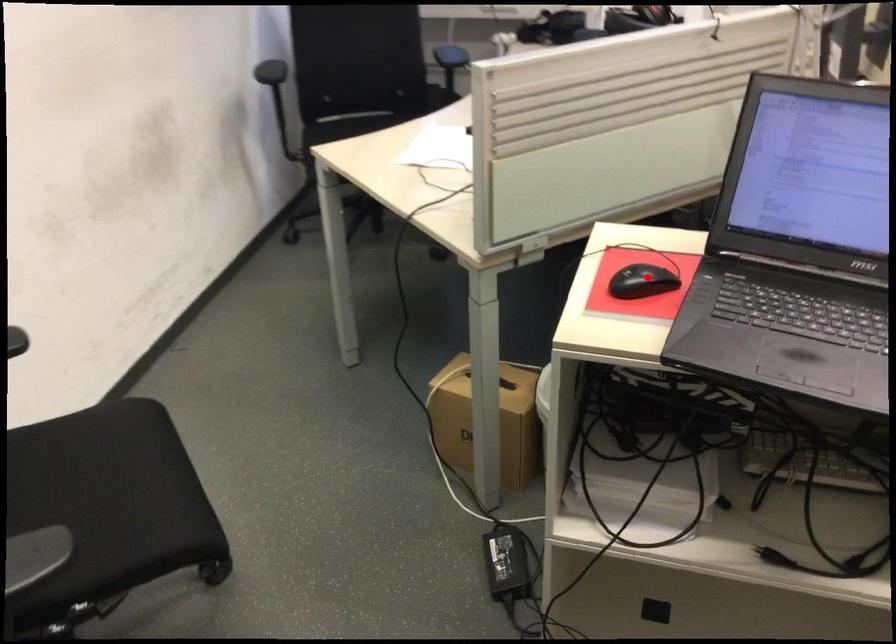
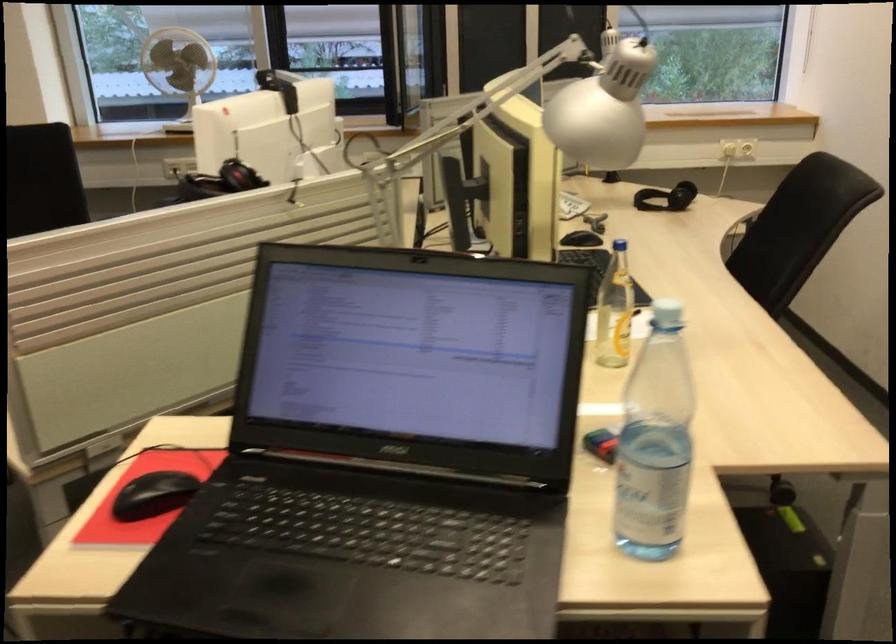
Question: I am providing you with two images of the same scene from different viewpoints. Given a red point in image1, look at the same physical point in image2. Is it:

Choices:
 (A) Closer to the viewpoint
 (B) Farther from the viewpoint

Answer: (A)